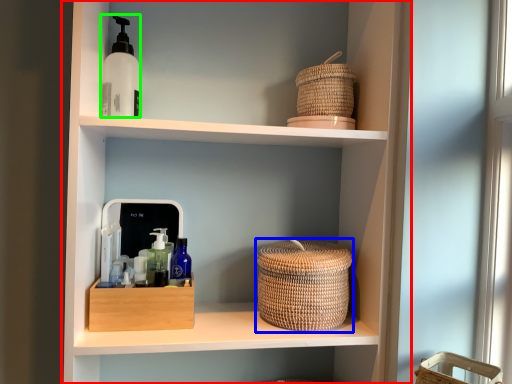
Question: Estimate the real-world distances between objects in this image. Which object is closer to shelf (highlighted by a red box), basket container (highlighted by a blue box) or mouthwash (highlighted by a green box)?

Choices:
 (A) basket container
 (B) mouthwash

Answer: (A)